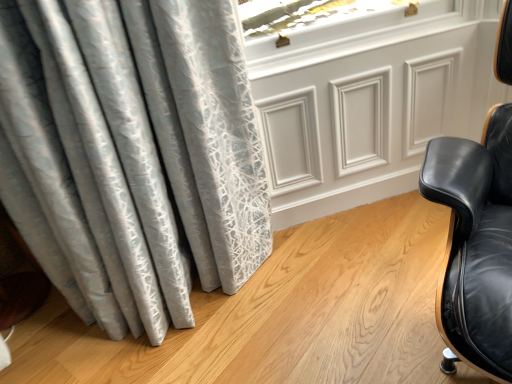
Question: From a real-world perspective, is white glossy panel at upper center positioned above or below black leather chair at right?

Choices:
 (A) below
 (B) above

Answer: (A)

Question: Is white glossy panel at upper center to the left or to the right of black leather chair at right in the image?

Choices:
 (A) right
 (B) left

Answer: (B)

Question: Looking at their shapes, would you say white glossy panel at upper center is wider or thinner than black leather chair at right?

Choices:
 (A) wide
 (B) thin

Answer: (B)

Question: In terms of width, does black leather chair at right look wider or thinner when compared to white glossy panel at upper center?

Choices:
 (A) thin
 (B) wide

Answer: (B)

Question: Considering the positions of black leather chair at right and white glossy panel at upper center in the image, is black leather chair at right bigger or smaller than white glossy panel at upper center?

Choices:
 (A) big
 (B) small

Answer: (A)

Question: Considering the relative positions of black leather chair at right and white glossy panel at upper center in the image provided, is black leather chair at right to the left or to the right of white glossy panel at upper center?

Choices:
 (A) left
 (B) right

Answer: (B)

Question: In the image, is black leather chair at right positioned in front of or behind white glossy panel at upper center?

Choices:
 (A) behind
 (B) front

Answer: (B)